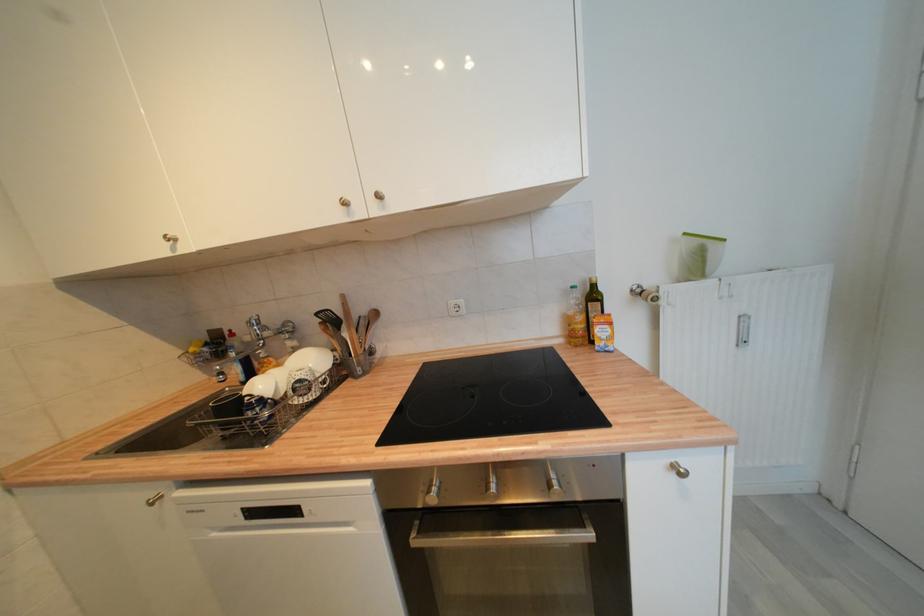
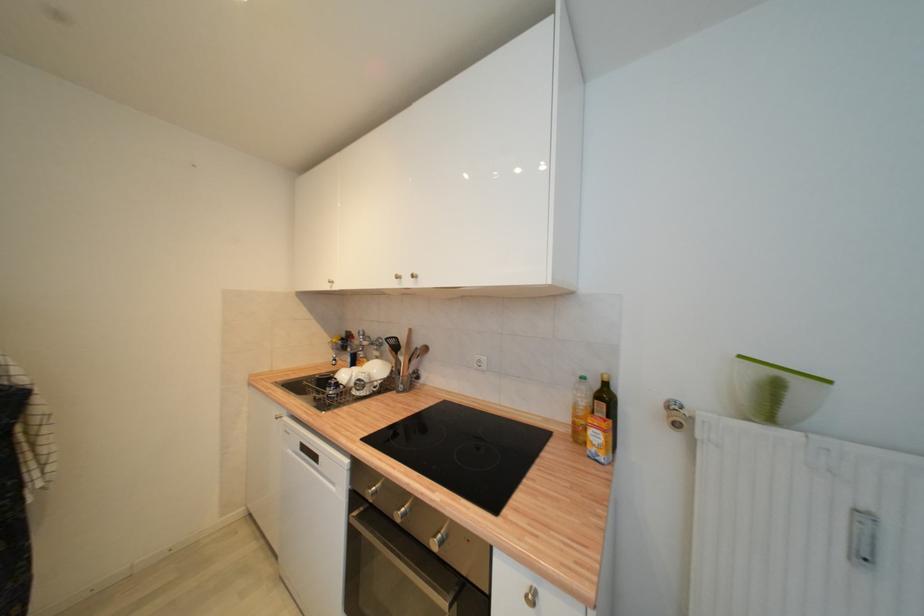
Where in the second image is the point corresponding to point 689,236 from the first image?

(746, 359)